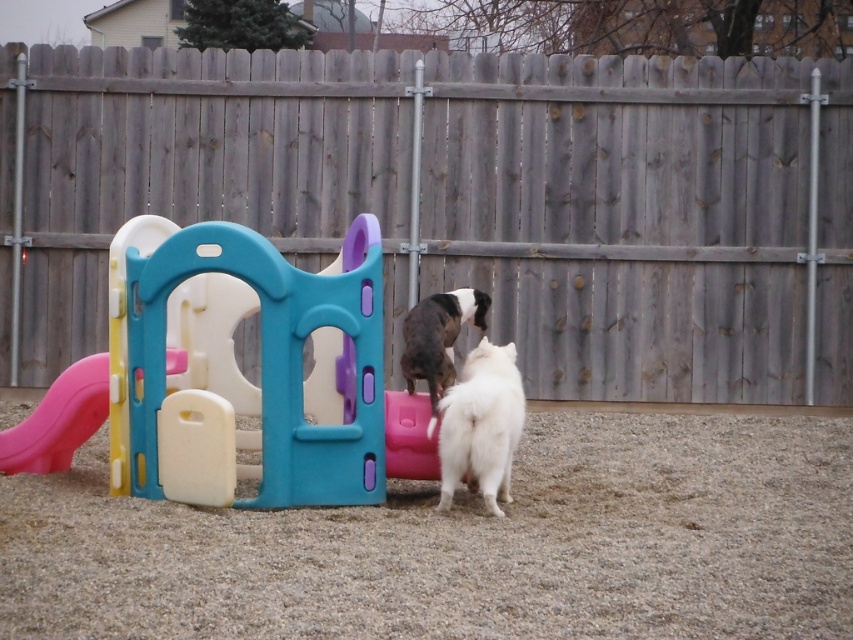
Question: Which of the following is the farthest from the observer?

Choices:
 (A) (793, 262)
 (B) (314, 477)
 (C) (460, 397)
 (D) (439, 362)

Answer: (A)

Question: Is white fluffy dog at center closer to the viewer compared to black and white fur at center?

Choices:
 (A) yes
 (B) no

Answer: (A)

Question: Which of the following is the farthest from the observer?

Choices:
 (A) (196, 342)
 (B) (24, 128)
 (C) (422, 326)
 (D) (477, 352)

Answer: (B)

Question: Can you confirm if white fluffy dog at center is smaller than black and white fur at center?

Choices:
 (A) no
 (B) yes

Answer: (A)

Question: In this image, where is wooden fence at center located relative to white fluffy dog at center?

Choices:
 (A) left
 (B) right

Answer: (A)

Question: Based on their relative distances, which object is nearer to the plastic playhouse at center?

Choices:
 (A) black and white fur at center
 (B) pink plastic slide at lower left

Answer: (B)